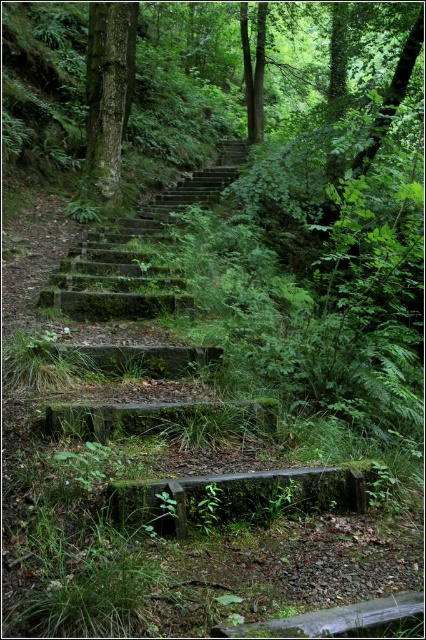
You are a hiker who wants to place a 3 feet long hiking pole between the mossy concrete stairs at center and the green mossy wood at lower center. Can the pole fit between them without overlapping either object?

The mossy concrete stairs at center is 8.63 feet away from green mossy wood at lower center. Since the pole is 3 feet long, it can fit between them without overlapping either object because the distance between the two objects is greater than the pole length.

You are standing at the bottom of the stone steps in the forest. You see two points marked in the scene. The first point is at coordinates point (261, 515) and the second is at point (114, 4). If you want to reach the point that is closer to you, which coordinate should you head towards?

Point (261, 515) is in front of point (114, 4), so the point closer to you is point (261, 515).

You are a hiker who wants to take a photo of the mossy concrete stairs at center and the green mossy tree trunk at upper left. Which object should you focus on first to ensure both are in the frame?

You should focus on the mossy concrete stairs at center first because it is closer to the viewer, ensuring both it and the green mossy tree trunk at upper left remain in the frame.